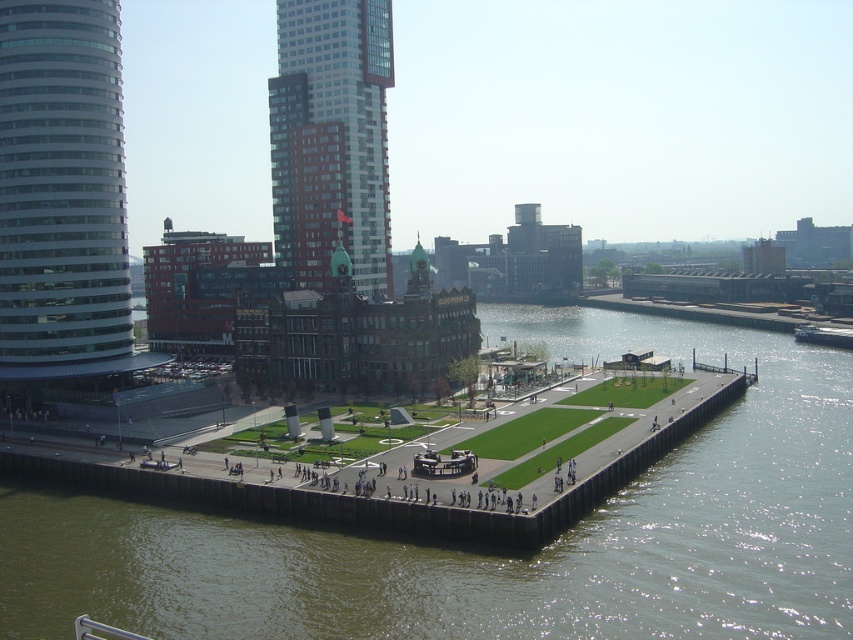
You are a tourist standing at the waterfront and want to take a photo of the red brick building at center without the green concrete river at lower center appearing in the frame. Is this possible based on their positions?

The green concrete river at lower center is positioned under the red brick building at center, so it would block the view of the building from certain angles. To avoid the river in the photo, you might need to position yourself higher or find a vantage point where the building is visible above the river.

You are standing at the point labeled point (x=62, y=193) in the image. What is the nearest object to you?

The nearest object to you is the glassy steel tower at left, which is indicated by the point (x=62, y=193).

You are standing at the center of the image and want to walk towards the green concrete river at lower center. In which direction should you move?

The green concrete river at lower center is located at coordinates approximately 0.872 on the x axis and 0.587 on the y axis. Since you are at the center, which is at coordinates 0.5 on both axes, you should move towards the right and slightly downward to reach the green concrete river at lower center.